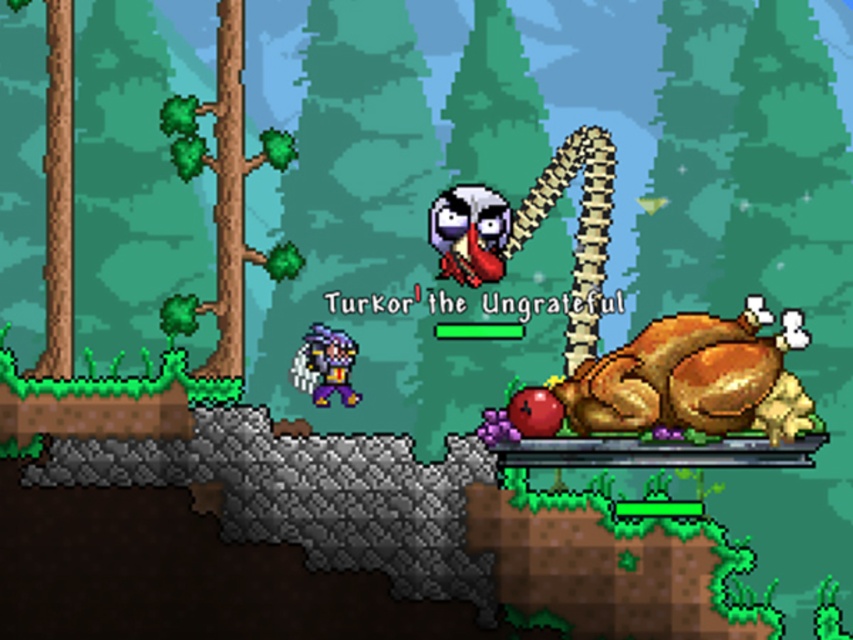
Who is positioned more to the left, golden roasted turkey at right or green matte tree trunk at left?

From the viewer's perspective, green matte tree trunk at left appears more on the left side.

Which is behind, point (589, 413) or point (229, 253)?

The point (229, 253) is behind.

Where is `golden roasted turkey at right`? This screenshot has height=640, width=853. golden roasted turkey at right is located at coordinates (692, 380).